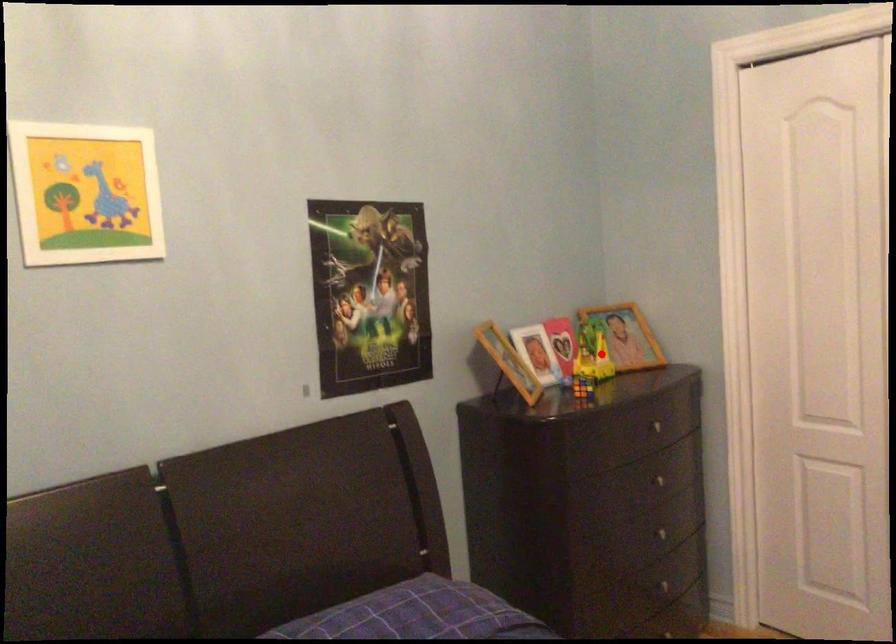
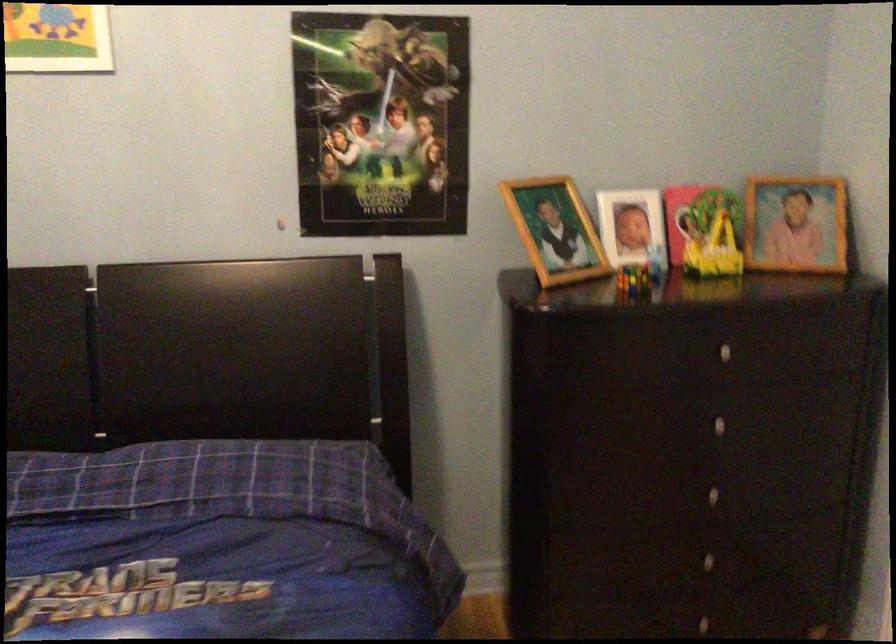
Where in the second image is the point corresponding to the highlighted location from the first image?

(719, 240)